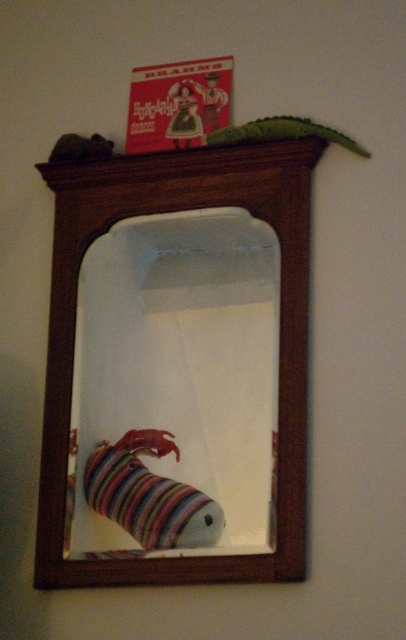
Question: Is green fabric alligator at upper center bigger than velvet plush toy at upper left?

Choices:
 (A) yes
 (B) no

Answer: (A)

Question: Which object is closer to the camera taking this photo?

Choices:
 (A) green fabric alligator at upper center
 (B) striped wool sock at lower left
 (C) matte plastic cowboy at upper center
 (D) wooden mirror at upper center

Answer: (D)

Question: Is green fabric alligator at upper center bigger than velvet plush toy at upper left?

Choices:
 (A) no
 (B) yes

Answer: (B)

Question: Does wooden mirror at upper center appear under velvet plush toy at upper left?

Choices:
 (A) yes
 (B) no

Answer: (A)

Question: Which object appears closest to the camera in this image?

Choices:
 (A) wooden mirror at upper center
 (B) striped wool sock at lower left

Answer: (A)

Question: Which object is farther from the camera taking this photo?

Choices:
 (A) wooden mirror at upper center
 (B) striped wool sock at lower left
 (C) green fabric alligator at upper center
 (D) matte plastic toy at upper center

Answer: (D)